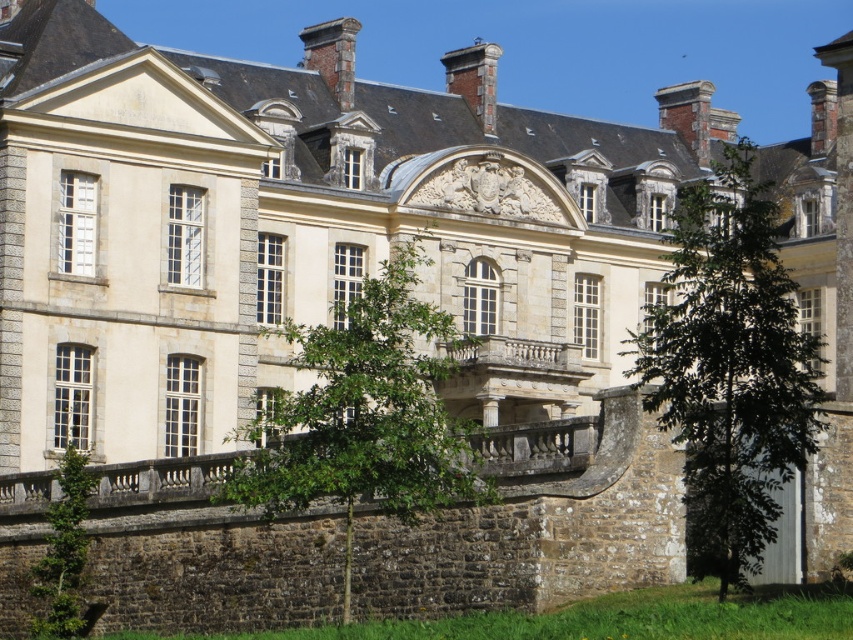
You are standing in front of the historic building and notice a point marked at coordinates [364,412]. What object is located at this position?

The point at coordinates [364,412] corresponds to a green leafy tree at center.

You are standing in front of the historic building and want to determine the relative positions of two points marked on its facade. The first point is at coordinates point (700, 196) and the second at point (399, 381). Which point is closer to you?

Point (700, 196) is closer to you than point (399, 381) because it is further to the viewer.

You are a landscape architect planning to install a new pathway between the two green leafy trees. The pathway requires a minimum of 40 feet of space. Based on the scene, can the pathway be constructed between the green leafy tree at center and the green leafy tree at lower left?

The distance between the green leafy tree at center and the green leafy tree at lower left is 44.85 feet, which exceeds the required 40 feet. Therefore, the pathway can be constructed between them.